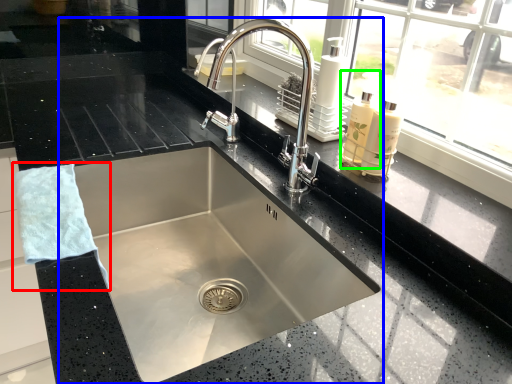
Question: Considering the real-world distances, which object is farthest from hand towel (highlighted by a red box)? sink (highlighted by a blue box) or soap dispenser (highlighted by a green box)?

Choices:
 (A) sink
 (B) soap dispenser

Answer: (B)